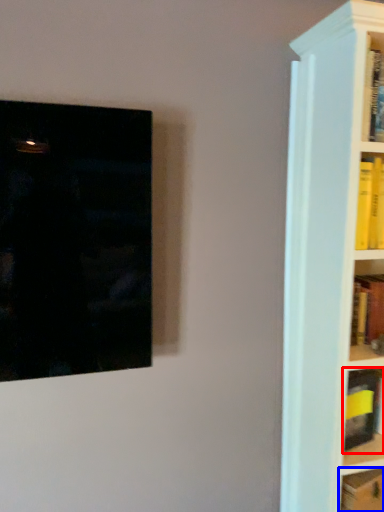
Question: Which of the following is the farthest to the observer, book (highlighted by a red box) or book (highlighted by a blue box)?

Choices:
 (A) book
 (B) book

Answer: (A)